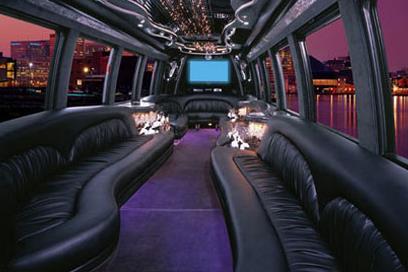
You are a GUI agent. You are given a task and a screenshot of the screen. Output one action in this format:
    pyautogui.click(x=<x>, y=<y>)
    Task: Click on the window
    The width and height of the screenshot is (408, 272).
    Given the screenshot: What is the action you would take?
    pos(357,43)